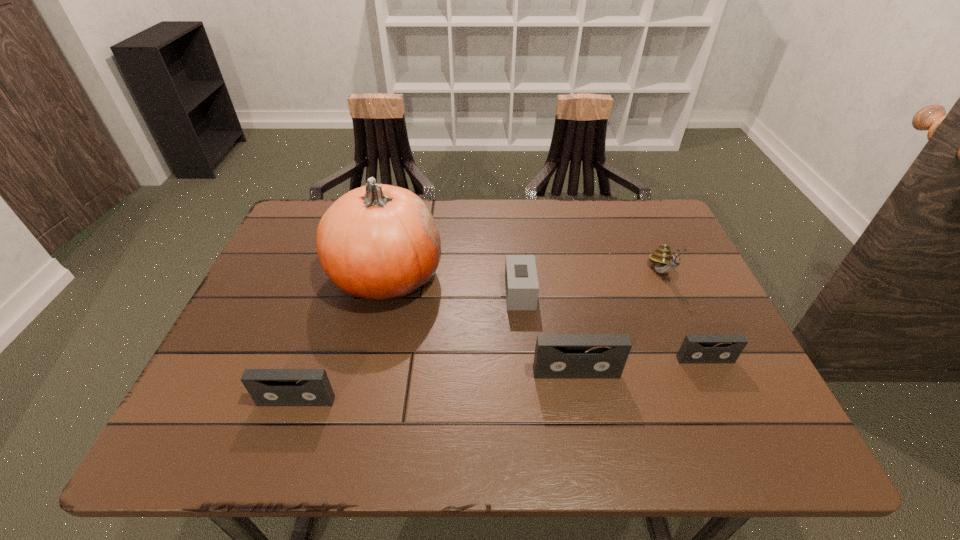
Find the location of a particular element. This screenshot has height=540, width=960. the second tallest videotape is located at coordinates (267, 387).

The width and height of the screenshot is (960, 540). What are the coordinates of `the leftmost videotape` in the screenshot? It's located at point(267,387).

The width and height of the screenshot is (960, 540). What are the coordinates of `the second nearest videotape` in the screenshot? It's located at (557, 356).

You are a GUI agent. You are given a task and a screenshot of the screen. Output one action in this format:
    pyautogui.click(x=<x>, y=<y>)
    Task: Click on the tallest videotape
    
    Given the screenshot: What is the action you would take?
    pyautogui.click(x=557, y=356)

I want to click on the farthest videotape, so coord(695,348).

Where is `the rightmost videotape`? the rightmost videotape is located at coordinates (695, 348).

This screenshot has height=540, width=960. Identify the location of pumpkin. (380, 242).

You are a GUI agent. You are given a task and a screenshot of the screen. Output one action in this format:
    pyautogui.click(x=<x>, y=<y>)
    Task: Click on the snail
    Image resolution: width=960 pixels, height=540 pixels.
    Given the screenshot: What is the action you would take?
    pyautogui.click(x=664, y=261)

Find the location of a particular element. Image resolution: width=960 pixels, height=540 pixels. alarm clock is located at coordinates (521, 281).

You are a GUI agent. You are given a task and a screenshot of the screen. Output one action in this format:
    pyautogui.click(x=<x>, y=<y>)
    Task: Click on the vacant space situated on the front-facing side of the second videotape from right to left
    
    Given the screenshot: What is the action you would take?
    pyautogui.click(x=582, y=404)